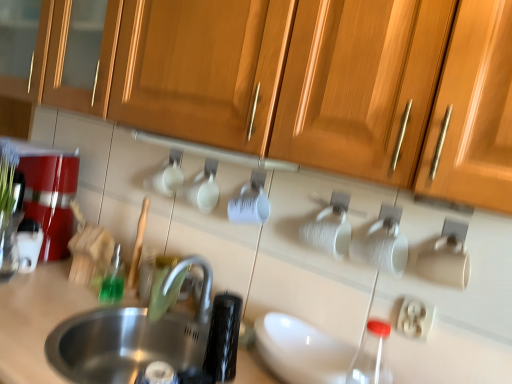
At what (x,y) coordinates should I click in order to perform the action: click on wooden cabinet at upper center. Please return your answer as a coordinate pair (x, y). The width and height of the screenshot is (512, 384). Looking at the image, I should click on (293, 82).

Where is `metallic red coffee machine at left`? The height and width of the screenshot is (384, 512). metallic red coffee machine at left is located at coordinates [x=51, y=198].

The image size is (512, 384). What do you see at coordinates (51, 198) in the screenshot? I see `metallic red coffee machine at left` at bounding box center [51, 198].

The image size is (512, 384). Describe the element at coordinates (113, 280) in the screenshot. I see `green translucent bottle at left` at that location.

Identify the location of wooden cabinet at upper center. [293, 82].

In the scene shown: Would you say white plastic electric outlet at lower right is to the left or to the right of green translucent bottle at left in the picture?

Clearly, white plastic electric outlet at lower right is on the right of green translucent bottle at left in the image.

Which point is more forward, (411, 317) or (104, 288)?

Positioned in front is point (411, 317).

From the image's perspective, is white plastic electric outlet at lower right over green translucent bottle at left?

Actually, white plastic electric outlet at lower right appears below green translucent bottle at left in the image.

Identify the location of bottle beneath the wooden cabinet at upper center (from a real-world perspective). (113, 280).

Is green translucent bottle at left inside the boundaries of wooden cabinet at upper center, or outside?

green translucent bottle at left is located beyond the bounds of wooden cabinet at upper center.

Consider the image. From the image's perspective, is green translucent bottle at left beneath wooden cabinet at upper center?

Yes, from the image's perspective, green translucent bottle at left is below wooden cabinet at upper center.

Is green translucent bottle at left bigger or smaller than wooden cabinet at upper center?

Considering their sizes, green translucent bottle at left takes up less space than wooden cabinet at upper center.

From the image's perspective, who appears lower, white plastic electric outlet at lower right or wooden cabinet at upper center?

white plastic electric outlet at lower right appears lower in the image.

Is white plastic electric outlet at lower right not near wooden cabinet at upper center?

No, there isn't a large distance between white plastic electric outlet at lower right and wooden cabinet at upper center.

Is point (410, 319) closer to camera compared to point (437, 194)?

No, (410, 319) is behind (437, 194).

Does point (432, 315) lie behind point (200, 308)?

No.

Which object is closer to the camera taking this photo, white plastic electric outlet at lower right or stainless steel sink at lower left?

stainless steel sink at lower left.

Can you confirm if white plastic electric outlet at lower right is smaller than stainless steel sink at lower left?

Yes.

From the image's perspective, relative to white glossy coffee maker at left, is white plastic electric outlet at lower right above or below?

From the image's perspective, white plastic electric outlet at lower right appears below white glossy coffee maker at left.

Is white plastic electric outlet at lower right with white glossy coffee maker at left?

There is a gap between white plastic electric outlet at lower right and white glossy coffee maker at left.

Is point (423, 334) positioned after point (36, 259)?

That is False.

Which is behind, point (116, 246) or point (410, 302)?

The point (116, 246) is behind.

Between green translucent bottle at left and white plastic electric outlet at lower right, which one has larger width?

green translucent bottle at left is wider.

From a real-world perspective, is green translucent bottle at left over white plastic electric outlet at lower right?

No, from a real-world perspective, green translucent bottle at left is not on top of white plastic electric outlet at lower right.

Based on their sizes in the image, would you say green translucent bottle at left is bigger or smaller than white plastic electric outlet at lower right?

In the image, green translucent bottle at left appears to be larger than white plastic electric outlet at lower right.

Which object is positioned more to the left, wooden cabinet at upper center or white glossy coffee maker at left?

Positioned to the left is white glossy coffee maker at left.

Where is `cabinetry that is above the white glossy coffee maker at left (from a real-world perspective)`? This screenshot has width=512, height=384. cabinetry that is above the white glossy coffee maker at left (from a real-world perspective) is located at coordinates (293, 82).

Is wooden cabinet at upper center situated inside white glossy coffee maker at left or outside?

wooden cabinet at upper center is outside white glossy coffee maker at left.

Considering the sizes of objects wooden cabinet at upper center and white glossy coffee maker at left in the image provided, who is shorter, wooden cabinet at upper center or white glossy coffee maker at left?

white glossy coffee maker at left is shorter.

Locate an element on the screen. electric outlet below the green translucent bottle at left (from the image's perspective) is located at coordinates (415, 318).

Locate an element on the screen. cabinetry in front of the green translucent bottle at left is located at coordinates (293, 82).

Which object lies nearer to the anchor point stainless steel sink at lower left, wooden cabinet at upper center or white plastic electric outlet at lower right?

wooden cabinet at upper center is positioned closer to the anchor stainless steel sink at lower left.

Which object lies further to the anchor point wooden cabinet at upper center, white glossy coffee maker at left or metallic red coffee machine at left?

white glossy coffee maker at left is further to wooden cabinet at upper center.

Looking at the image, which one is located closer to green translucent bottle at left, metallic red coffee machine at left or white plastic electric outlet at lower right?

The object closer to green translucent bottle at left is metallic red coffee machine at left.

Which object lies nearer to the anchor point green translucent bottle at left, wooden cabinet at upper center or white glossy coffee maker at left?

white glossy coffee maker at left is positioned closer to the anchor green translucent bottle at left.

From the image, which object appears to be nearer to white plastic electric outlet at lower right, stainless steel sink at lower left or green translucent bottle at left?

stainless steel sink at lower left lies closer to white plastic electric outlet at lower right than the other object.

Which object lies further to the anchor point stainless steel sink at lower left, metallic red coffee machine at left or wooden cabinet at upper center?

Result: wooden cabinet at upper center.

When comparing their distances from metallic red coffee machine at left, does wooden cabinet at upper center or white plastic electric outlet at lower right seem further?

The object further to metallic red coffee machine at left is white plastic electric outlet at lower right.

Considering their positions, is green translucent bottle at left positioned closer to white glossy coffee maker at left than wooden cabinet at upper center?

green translucent bottle at left.

At what (x,y) coordinates should I click in order to perform the action: click on bottle between stainless steel sink at lower left and metallic red coffee machine at left from front to back. Please return your answer as a coordinate pair (x, y). Looking at the image, I should click on (113, 280).

You are a GUI agent. You are given a task and a screenshot of the screen. Output one action in this format:
    pyautogui.click(x=<x>, y=<y>)
    Task: Click on the sink between white glossy coffee maker at left and white plastic electric outlet at lower right from left to right
    This screenshot has height=384, width=512.
    Given the screenshot: What is the action you would take?
    coord(123,344)

Where is `sink between green translucent bottle at left and white plastic electric outlet at lower right`? Image resolution: width=512 pixels, height=384 pixels. sink between green translucent bottle at left and white plastic electric outlet at lower right is located at coordinates (123, 344).

Where is `appliance that lies between wooden cabinet at upper center and stainless steel sink at lower left from top to bottom`? Image resolution: width=512 pixels, height=384 pixels. appliance that lies between wooden cabinet at upper center and stainless steel sink at lower left from top to bottom is located at coordinates (29, 244).